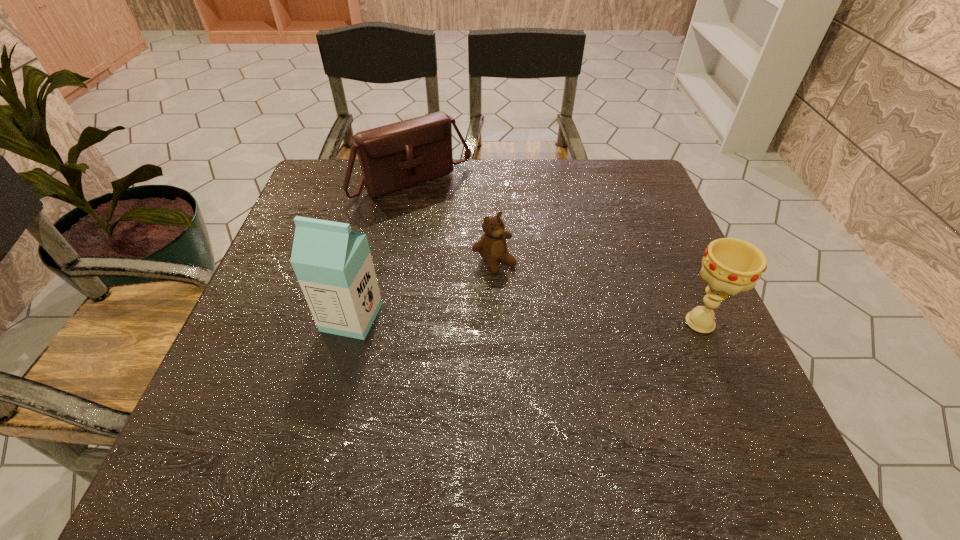
Image resolution: width=960 pixels, height=540 pixels. In order to click on vacant space at the right edge of the desktop in this screenshot , I will do coord(692,307).

The height and width of the screenshot is (540, 960). I want to click on vacant space at the far left corner, so click(x=337, y=185).

You are a GUI agent. You are given a task and a screenshot of the screen. Output one action in this format:
    pyautogui.click(x=<x>, y=<y>)
    Task: Click on the vacant space at the far right corner of the desktop
    This screenshot has height=540, width=960.
    Given the screenshot: What is the action you would take?
    click(x=641, y=177)

The image size is (960, 540). What are the coordinates of `free spot between the farthest object and the tallest object` in the screenshot? It's located at (382, 249).

The height and width of the screenshot is (540, 960). What are the coordinates of `free spot between the shoulder bag and the chalice` in the screenshot? It's located at (556, 252).

Find the location of a particular element. The width and height of the screenshot is (960, 540). vacant space that is in between the shortest object and the farthest object is located at coordinates (453, 222).

Find the location of a particular element. The height and width of the screenshot is (540, 960). vacant space that's between the teddy bear and the milk carton is located at coordinates (423, 289).

Where is `free space between the teddy bear and the tallest object`? The width and height of the screenshot is (960, 540). free space between the teddy bear and the tallest object is located at coordinates (423, 289).

Find the location of a particular element. Image resolution: width=960 pixels, height=540 pixels. vacant area between the milk carton and the farthest object is located at coordinates (382, 249).

You are a GUI agent. You are given a task and a screenshot of the screen. Output one action in this format:
    pyautogui.click(x=<x>, y=<y>)
    Task: Click on the blank region between the shortest object and the rightmost object
    The image size is (960, 540).
    Given the screenshot: What is the action you would take?
    pyautogui.click(x=597, y=292)